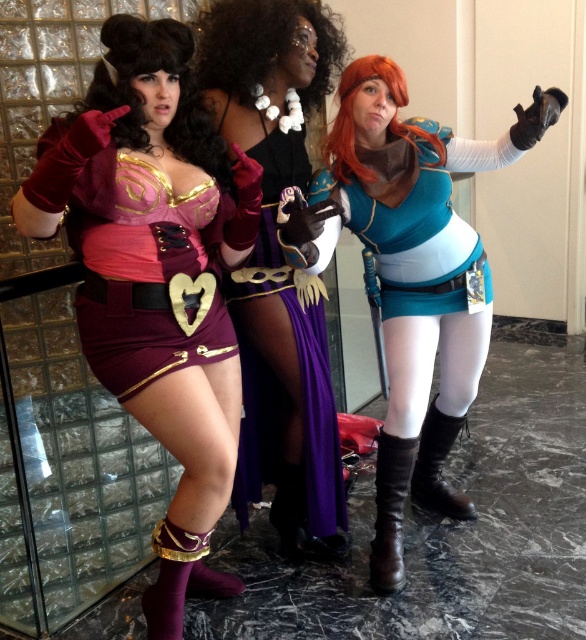
Question: Can you confirm if velvet wig at center is positioned to the left of brown leather boot at lower right?

Choices:
 (A) no
 (B) yes

Answer: (B)

Question: Which point is farther to the camera?

Choices:
 (A) (465, 148)
 (B) (165, 316)
 (C) (216, 163)
 (D) (132, 202)

Answer: (A)

Question: Which object is closer to the camera taking this photo?

Choices:
 (A) brown leather boot at lower center
 (B) velvet/purple dress at center
 (C) shiny purple dress at center
 (D) velvet wig at center

Answer: (B)

Question: Can you confirm if velvet/purple dress at center is positioned to the left of orange synthetic wig at right?

Choices:
 (A) no
 (B) yes

Answer: (B)

Question: Which point is closer to the camera?

Choices:
 (A) brown leather boot at lower right
 (B) velvet/purple dress at center

Answer: (B)

Question: Does purple velvet boot at lower left have a greater width compared to brown leather boot at lower right?

Choices:
 (A) yes
 (B) no

Answer: (A)